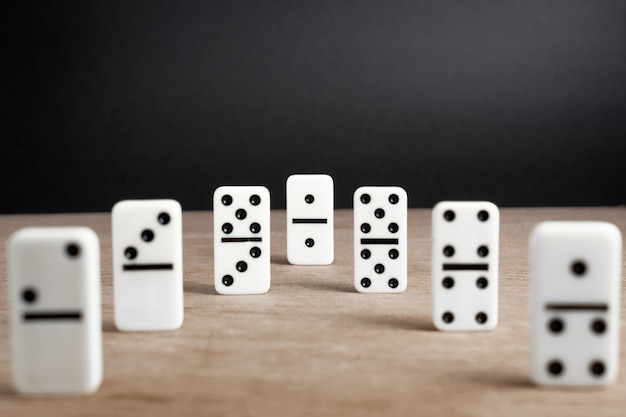
Find the location of a particular element. This screenshot has width=626, height=417. dominoes is located at coordinates (577, 333), (458, 285), (389, 264), (319, 223), (250, 256), (143, 281), (52, 356).